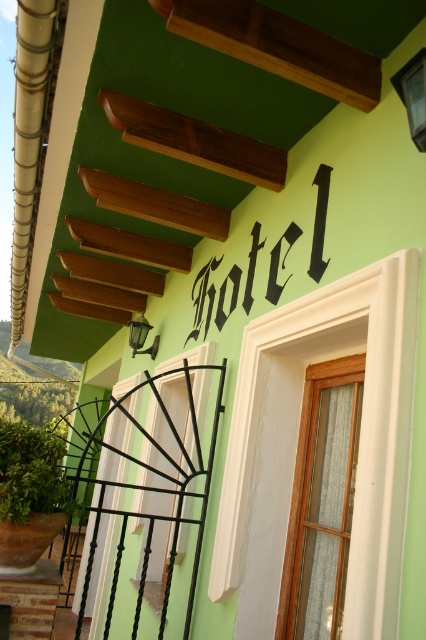
Question: Which of the following is the farthest from the observer?

Choices:
 (A) (103, 621)
 (B) (31, 502)
 (C) (210, 257)

Answer: (A)

Question: Among these points, which one is nearest to the camera?

Choices:
 (A) (74, 499)
 (B) (409, 106)

Answer: (B)

Question: Does matte black lamp at upper right come behind matte black lamp at upper center?

Choices:
 (A) yes
 (B) no

Answer: (B)

Question: Is blackmaterial/texturehotel at upper center below matte black lamp at upper right?

Choices:
 (A) yes
 (B) no

Answer: (A)

Question: Where is green leafy plant at lower left located in relation to matte black lamp at upper center in the image?

Choices:
 (A) right
 (B) left

Answer: (B)

Question: Which of the following is the closest to the observer?

Choices:
 (A) (409, 109)
 (B) (131, 344)

Answer: (A)